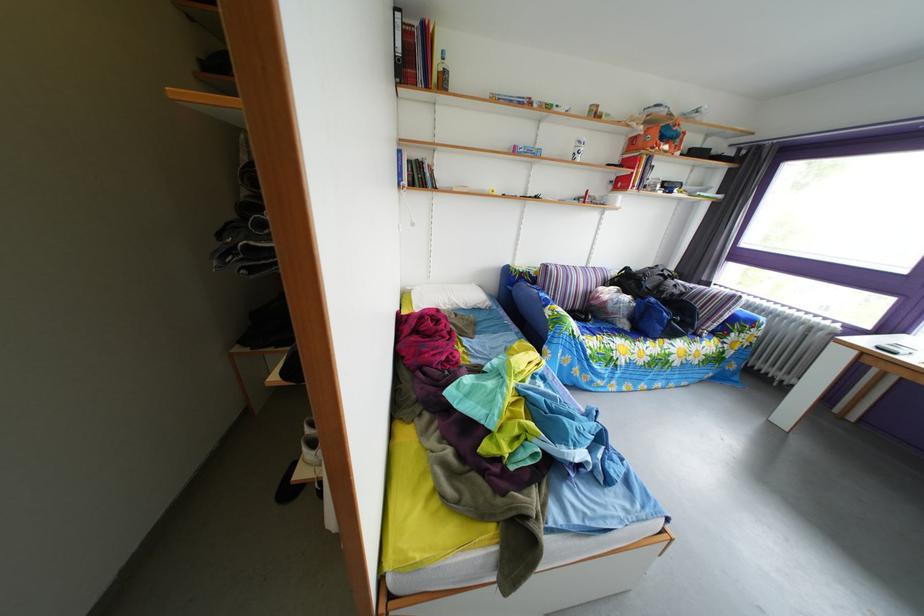
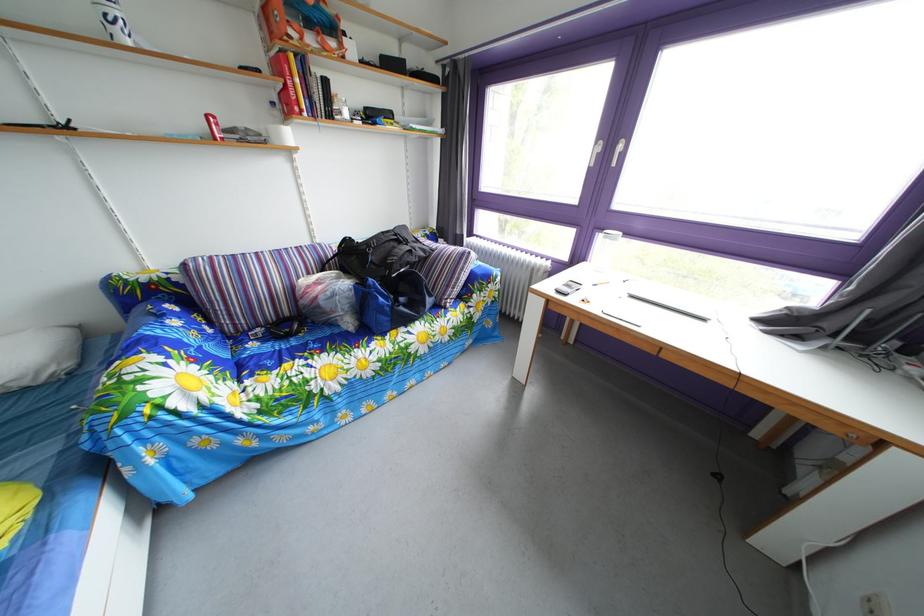
The point at (622, 190) is marked in the first image. Where is the corresponding point in the second image?

(284, 111)